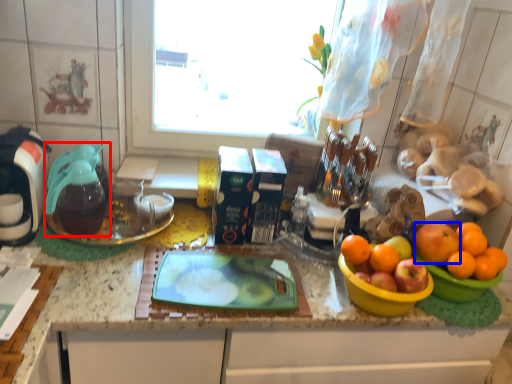
Question: Among these objects, which one is nearest to the camera, coffeepot (highlighted by a red box) or orange (highlighted by a blue box)?

Choices:
 (A) coffeepot
 (B) orange

Answer: (B)